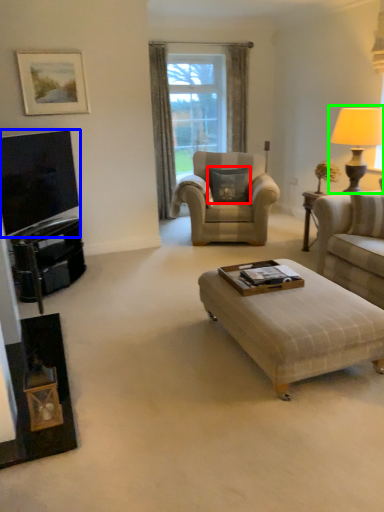
Question: Which object is positioned farthest from pillow (highlighted by a red box)? Select from television (highlighted by a blue box) and table lamp (highlighted by a green box).

Choices:
 (A) television
 (B) table lamp

Answer: (A)